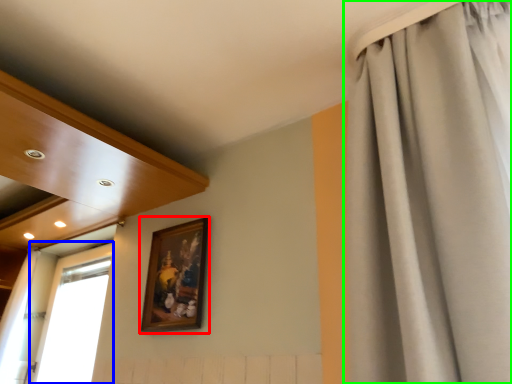
Question: Which is farther away from picture frame (highlighted by a red box)? window (highlighted by a blue box) or curtain (highlighted by a green box)?

Choices:
 (A) window
 (B) curtain

Answer: (A)